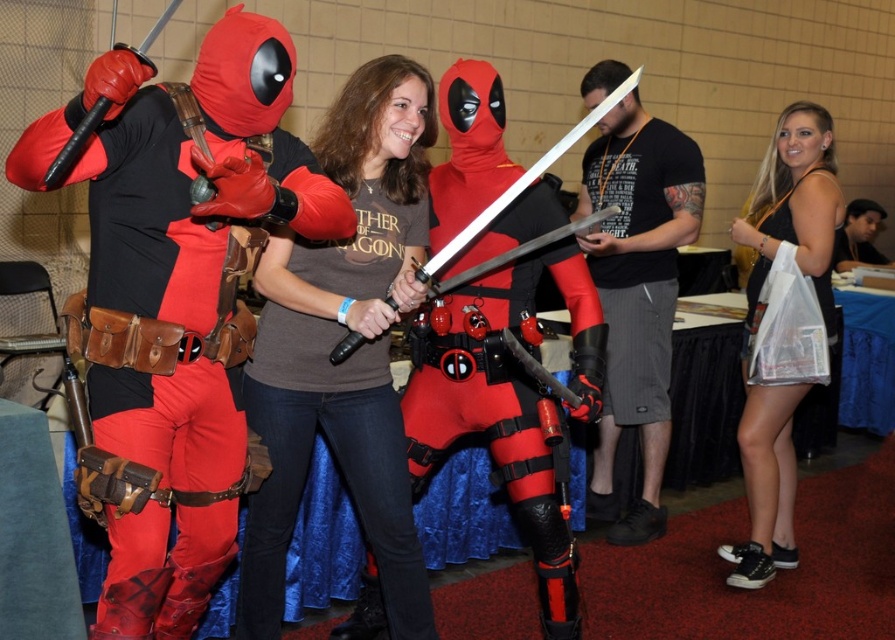
You are a photographer standing at the camera position. You want to take a photo of the matte black tank top at center. Can you reach it with your 2.8 meter long extendable pole?

The matte black tank top at center and camera are 2.91 meters apart. The extendable pole is 2.8 meters, so it is slightly shorter than the distance. Therefore, you cannot reach the matte black tank top at center with the pole.

You are a photographer at the event and need to capture a clear shot of both the matte black tank top at center and the matte black sword at center. Given their sizes, which object should you focus on first to ensure it is in sharp focus?

The matte black tank top at center is larger in size than the matte black sword at center, so you should focus on the matte black tank top at center first to ensure it is in sharp focus.